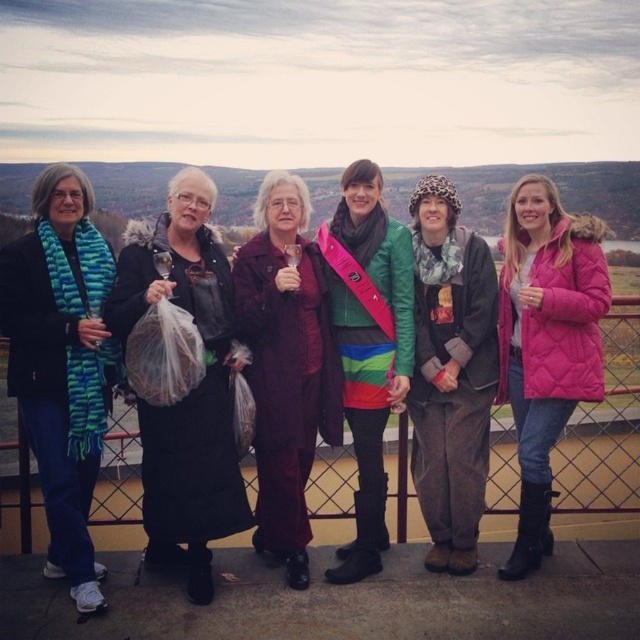
Looking at this image, you are a photographer trying to capture a photo of the teal knitted scarf at left and the leopard print scarf at center. Which scarf is closer to the camera?

The teal knitted scarf at left is positioned under the leopard print scarf at center, so the leopard print scarf at center is closer to the camera.

You are a photographer trying to capture a group photo of the teal knitted scarf at left and the leopard print scarf at center. Since you want to ensure both scarves are clearly visible, which scarf should you focus on first to avoid blurriness due to size differences?

The teal knitted scarf at left is bigger than the leopard print scarf at center, so you should focus on the teal knitted scarf at left first to ensure clarity.

You are a fashion designer observing the group on the balcony. You need to create a new scarf design that matches the size of the teal knitted scarf at left. Which object in the scene can you use as a reference for the size of the pink quilted jacket at right?

The teal knitted scarf at left is larger than the pink quilted jacket at right, so you can use the pink quilted jacket at right as a reference to determine the smaller size needed for the scarf design.